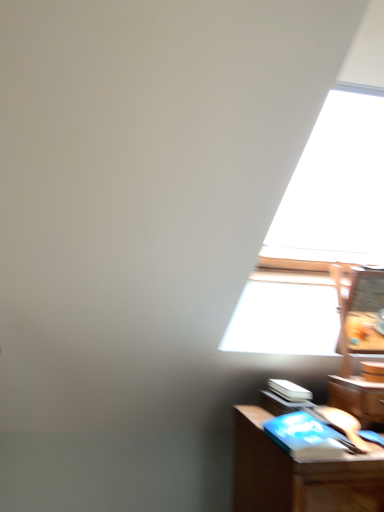
This screenshot has height=512, width=384. In order to click on wooden drawer at lower right in this screenshot , I will do `click(357, 398)`.

What do you see at coordinates (357, 398) in the screenshot? I see `wooden drawer at lower right` at bounding box center [357, 398].

What are the coordinates of `wooden drawer at lower right` in the screenshot? It's located at (357, 398).